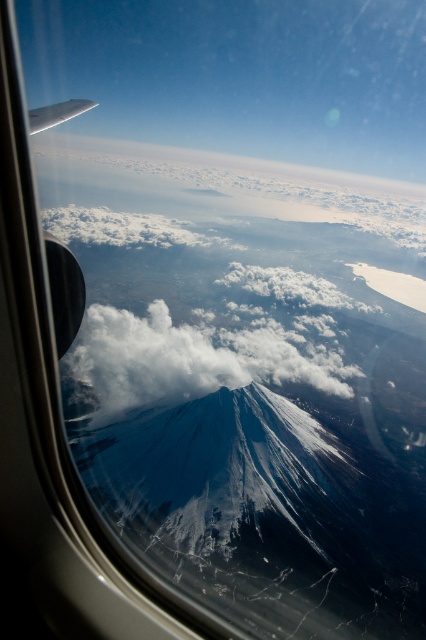
Question: Which object appears closest to the camera in this image?

Choices:
 (A) white matte wing at upper left
 (B) white fluffy cloud at center

Answer: (A)

Question: Is white fluffy cloud at center above white matte wing at upper left?

Choices:
 (A) yes
 (B) no

Answer: (B)

Question: Among these objects, which one is nearest to the camera?

Choices:
 (A) white matte wing at upper left
 (B) white fluffy cloud at center

Answer: (A)

Question: Does white fluffy cloud at center appear on the right side of white matte wing at upper left?

Choices:
 (A) no
 (B) yes

Answer: (B)

Question: Does white fluffy cloud at center appear on the right side of white matte wing at upper left?

Choices:
 (A) yes
 (B) no

Answer: (A)